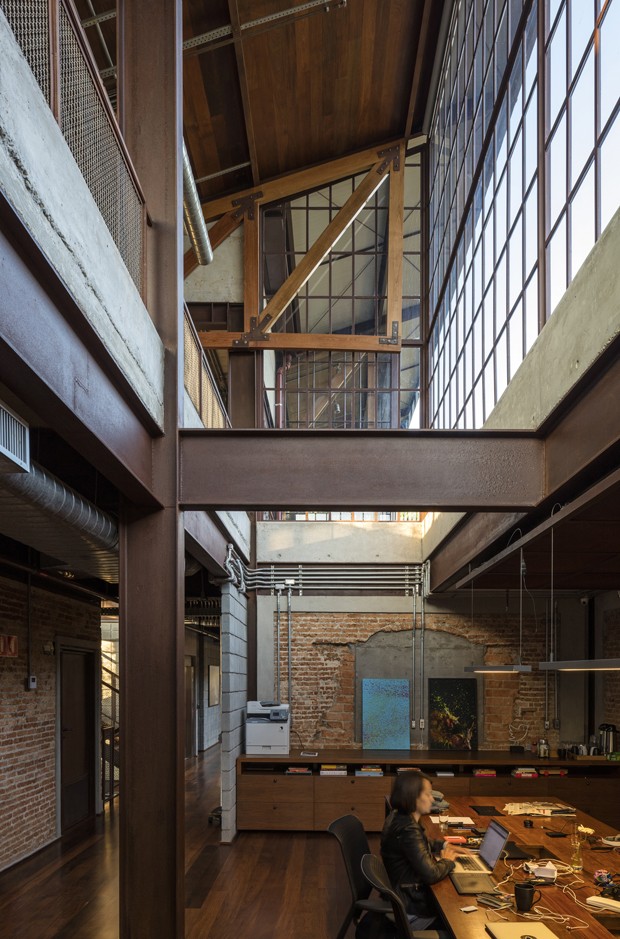
Locate an element on the screen. This screenshot has height=939, width=620. cup is located at coordinates (525, 901).